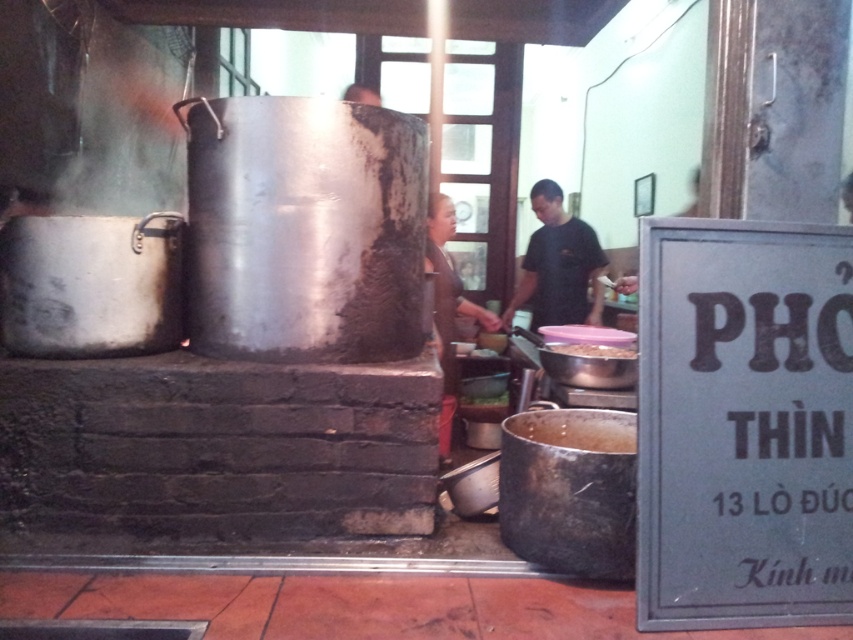
Can you confirm if brown matte pot at center is wider than white matte bowl at center?

Indeed, brown matte pot at center has a greater width compared to white matte bowl at center.

Is brown matte pot at center above white matte bowl at center?

No.

Identify the location of brown matte pot at center. (576, 429).

Is black matte shirt at center below matte silver pot at center?

Actually, black matte shirt at center is above matte silver pot at center.

Who is more forward, (538, 243) or (496, 397)?

Positioned in front is point (496, 397).

Find the location of a particular element. The height and width of the screenshot is (640, 853). black matte shirt at center is located at coordinates (558, 264).

From the picture: Between brown matte pot at center and matte silver pot at center, which one appears on the right side from the viewer's perspective?

brown matte pot at center

This screenshot has height=640, width=853. What do you see at coordinates (576, 429) in the screenshot? I see `brown matte pot at center` at bounding box center [576, 429].

This screenshot has width=853, height=640. What are the coordinates of `brown matte pot at center` in the screenshot? It's located at (576, 429).